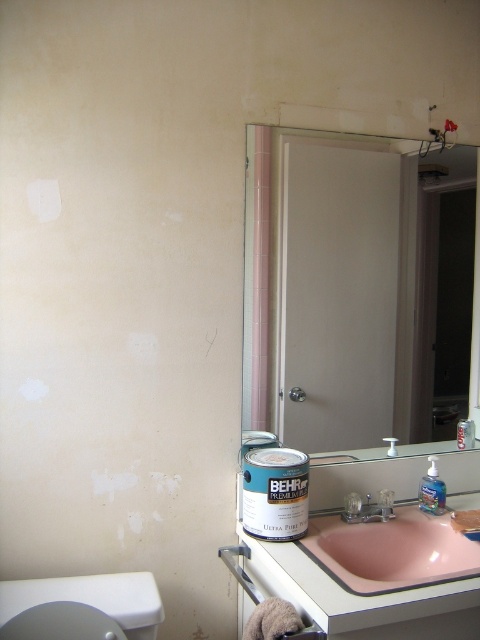
You are a contractor assessing the bathroom layout. The smooth white door at right and the white glossy toilet bowl at lower left are both in your line of sight. Which object is positioned higher relative to the other?

The smooth white door at right is located above the white glossy toilet bowl at lower left, so it is positioned higher.

You are a painter who needs to access the pink glossy sink at lower center to wash your hands. The smooth white door at right is currently closed. Can you reach the sink without opening the door?

The pink glossy sink at lower center is behind the smooth white door at right, so you cannot reach it without opening the door first.

You are a painter standing in the bathroom and need to reach the smooth white door at right to close it. Can you close it without moving your position?

The smooth white door at right is 1.74 meters away from you, so you can reach it without moving your position if your arm can extend that far. However, typically, human arm reach is about 1 meter, so you might need to step closer.